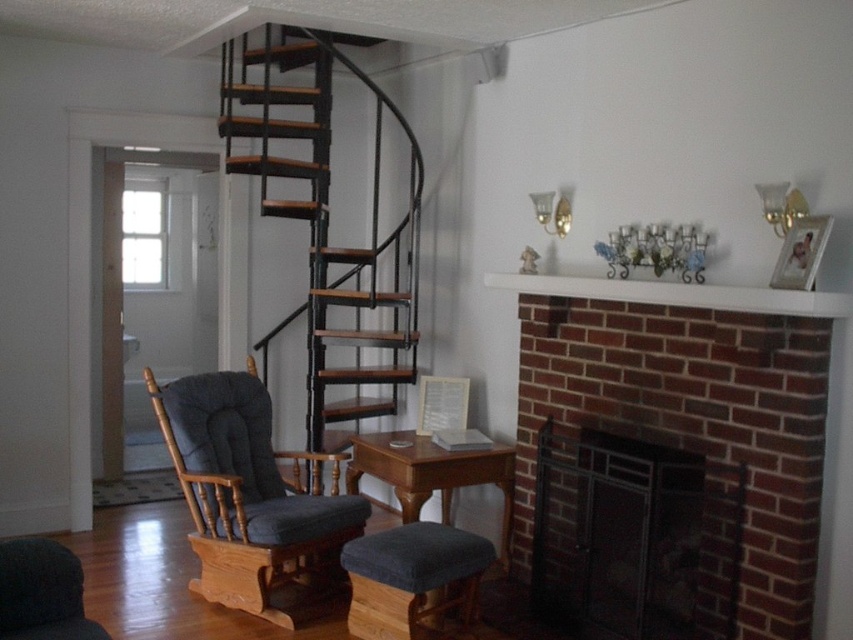
Question: Which point appears closest to the camera in this image?

Choices:
 (A) (440, 573)
 (B) (785, 458)

Answer: (B)

Question: In this image, where is black metal fireplace at lower right located relative to dark blue fabric rocking chair at left?

Choices:
 (A) right
 (B) left

Answer: (A)

Question: Which object appears closest to the camera in this image?

Choices:
 (A) wooden table at center
 (B) white glossy mantel at upper center

Answer: (B)

Question: Which point is closer to the camera?

Choices:
 (A) (329, 452)
 (B) (796, 492)
 (C) (410, 490)

Answer: (B)

Question: Does brick fireplace at center come behind dark blue fabric rocking chair at left?

Choices:
 (A) yes
 (B) no

Answer: (B)

Question: Does black metal fireplace at lower right appear on the left side of dark blue fabric rocking chair at left?

Choices:
 (A) yes
 (B) no

Answer: (B)